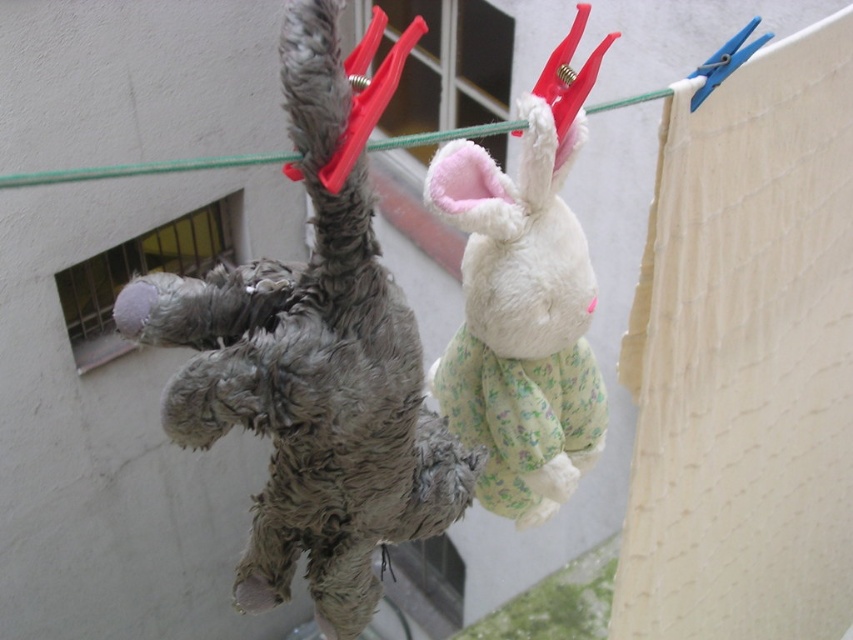
Who is taller, fuzzy gray stuffed animal at left or white plush rabbit at center?

fuzzy gray stuffed animal at left is taller.

Between fuzzy gray stuffed animal at left and white plush rabbit at center, which one has less height?

white plush rabbit at center is shorter.

Locate an element on the screen. The image size is (853, 640). fuzzy gray stuffed animal at left is located at coordinates (314, 362).

Find the location of `fuzzy gray stuffed animal at left`. fuzzy gray stuffed animal at left is located at coordinates (314, 362).